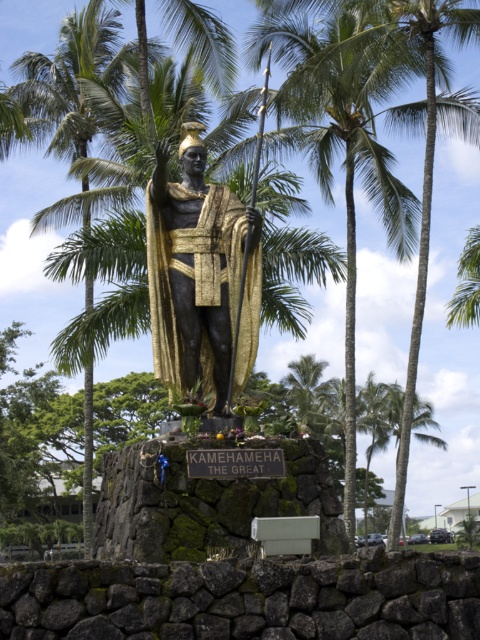
You are an artist planning to sketch the statue of King Kamehameha I. You notice two green leafy palm trees in the scene. Which palm tree is closer to the statue? Please choose between the green leafy palm tree at center and the green leafy palm tree at left.

The green leafy palm tree at center is smaller than the green leafy palm tree at left, so the green leafy palm tree at left is closer to the statue.

You are a tourist standing in front of the bronze statue at center and want to take a photo with the green leafy palm tree at center in the background. Can you position yourself so that the palm tree is fully visible behind the statue?

The green leafy palm tree at center is positioned on the right side of bronze statue at center, so if you stand to the left of the bronze statue at center, the palm tree will be fully visible behind it.